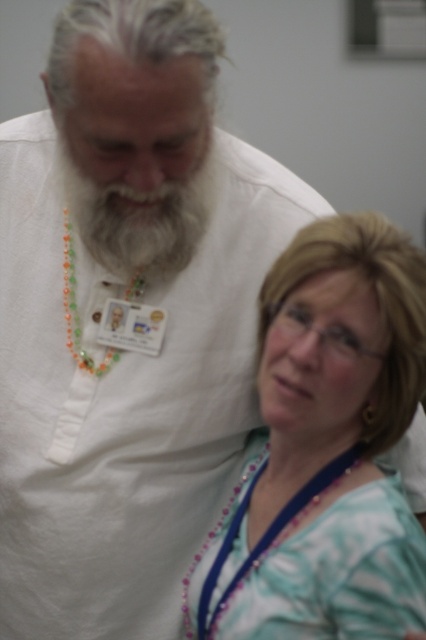
Between teal striped shirt at lower right and graywool-likebeard at center, which one appears on the left side from the viewer's perspective?

Positioned to the left is graywool-likebeard at center.

Image resolution: width=426 pixels, height=640 pixels. In order to click on teal striped shirt at lower right in this screenshot , I will do `click(327, 449)`.

Between point (336, 300) and point (152, 218), which one is positioned behind?

The point (152, 218) is behind.

Find the location of a particular element. The width and height of the screenshot is (426, 640). teal striped shirt at lower right is located at coordinates (327, 449).

Which of these two, teal striped shirt at lower right or purple beaded necklace at center, stands taller?

Standing taller between the two is teal striped shirt at lower right.

Who is shorter, teal striped shirt at lower right or purple beaded necklace at center?

Standing shorter between the two is purple beaded necklace at center.

Is point (298, 412) more distant than point (299, 500)?

No, it is in front of (299, 500).

Where is `teal striped shirt at lower right`? The height and width of the screenshot is (640, 426). teal striped shirt at lower right is located at coordinates (327, 449).

Is graywool-likebeard at center taller than purple beaded necklace at center?

No.

Is graywool-likebeard at center further to the viewer compared to purple beaded necklace at center?

Yes, it is behind purple beaded necklace at center.

Where is `graywool-likebeard at center`? The height and width of the screenshot is (640, 426). graywool-likebeard at center is located at coordinates (140, 221).

Identify the location of graywool-likebeard at center. (140, 221).